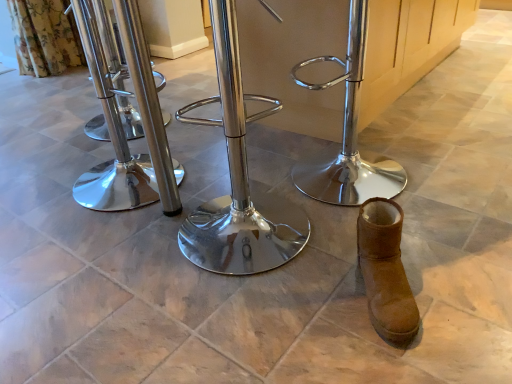
Locate an element on the screen. Image resolution: width=512 pixels, height=384 pixels. vacant space to the left of polished metal swivel chair at center, marked as the 3th swivel chair in a right-to-left arrangement is located at coordinates (37, 183).